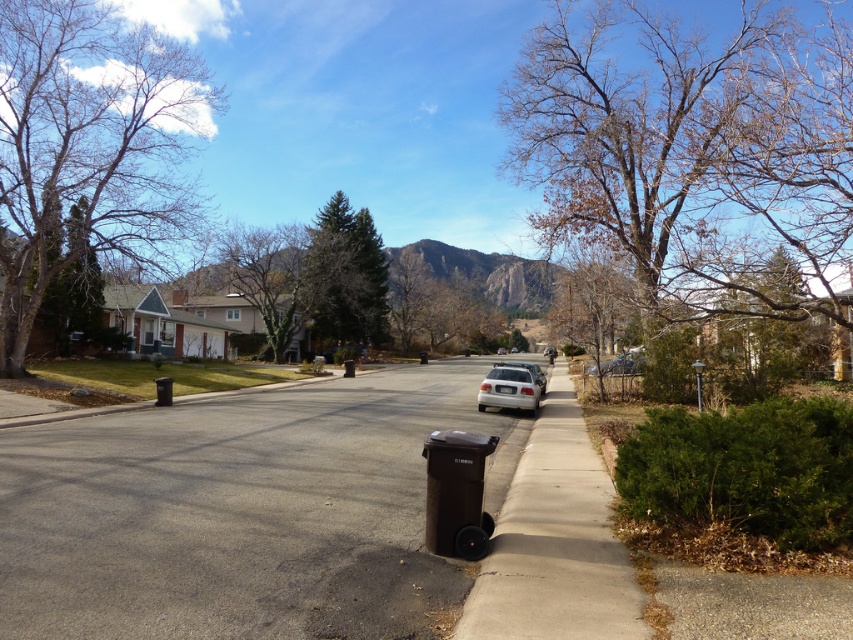
Can you confirm if dark gray asphalt at center is wider than brown leafless tree at left?

Indeed, dark gray asphalt at center has a greater width compared to brown leafless tree at left.

Looking at this image, who is more distant from viewer, (177, 413) or (49, 88)?

Point (49, 88)

Where is `dark gray asphalt at center`? The image size is (853, 640). dark gray asphalt at center is located at coordinates (241, 513).

Measure the distance between point (604, 108) and camera.

Point (604, 108) is 29.62 meters away from camera.

The height and width of the screenshot is (640, 853). I want to click on bare wood tree at right, so click(x=698, y=156).

Does point (614, 172) come behind point (279, 275)?

No, (614, 172) is closer to viewer.

You are a GUI agent. You are given a task and a screenshot of the screen. Output one action in this format:
    pyautogui.click(x=<x>, y=<y>)
    Task: Click on the bare wood tree at right
    
    Given the screenshot: What is the action you would take?
    pyautogui.click(x=698, y=156)

Is bare wood tree at right shorter than brown concrete curb at lower center?

No.

Between point (628, 132) and point (529, 595), which one is positioned in front?

Point (529, 595) is in front.

This screenshot has width=853, height=640. Identify the location of bare wood tree at right. (698, 156).